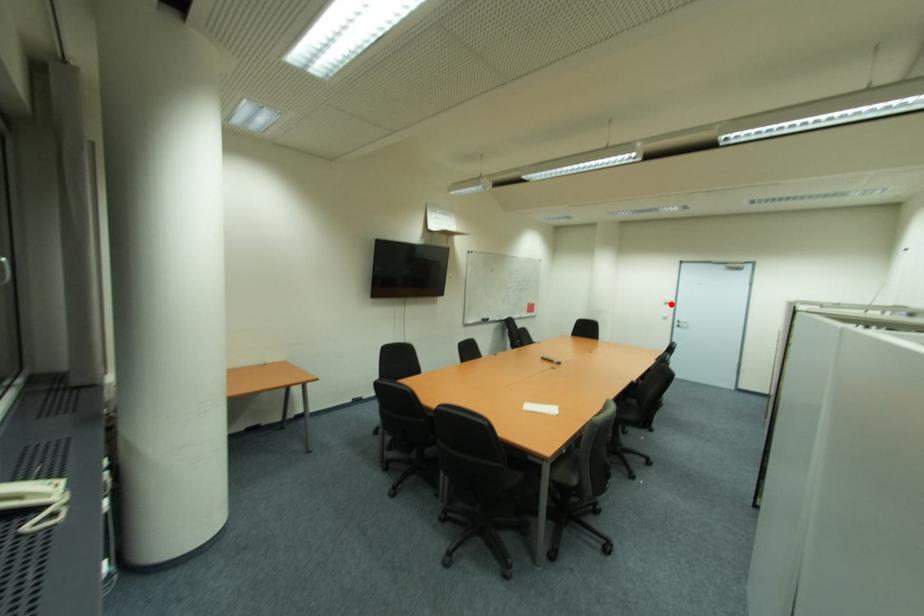
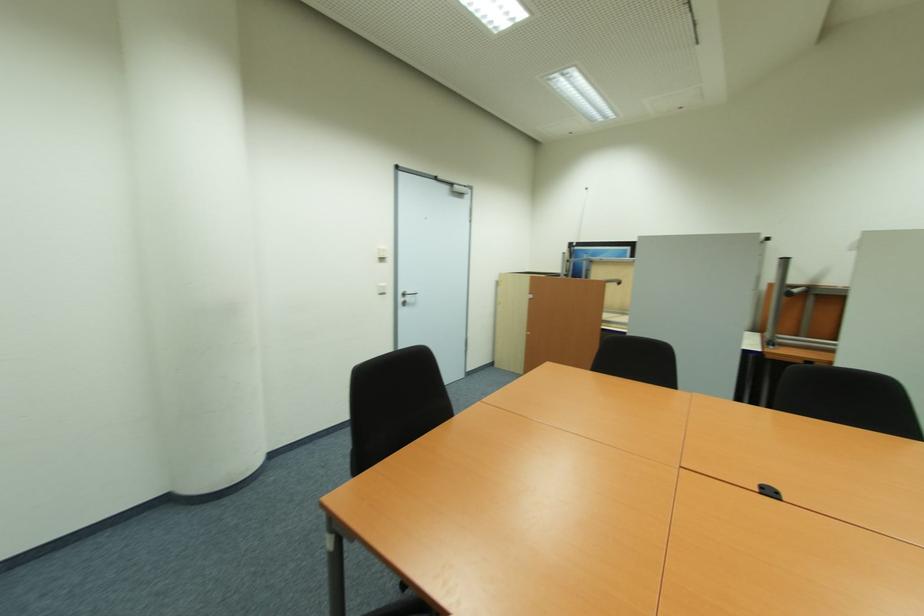
The point at the highlighted location is marked in the first image. Where is the corresponding point in the second image?

(385, 260)